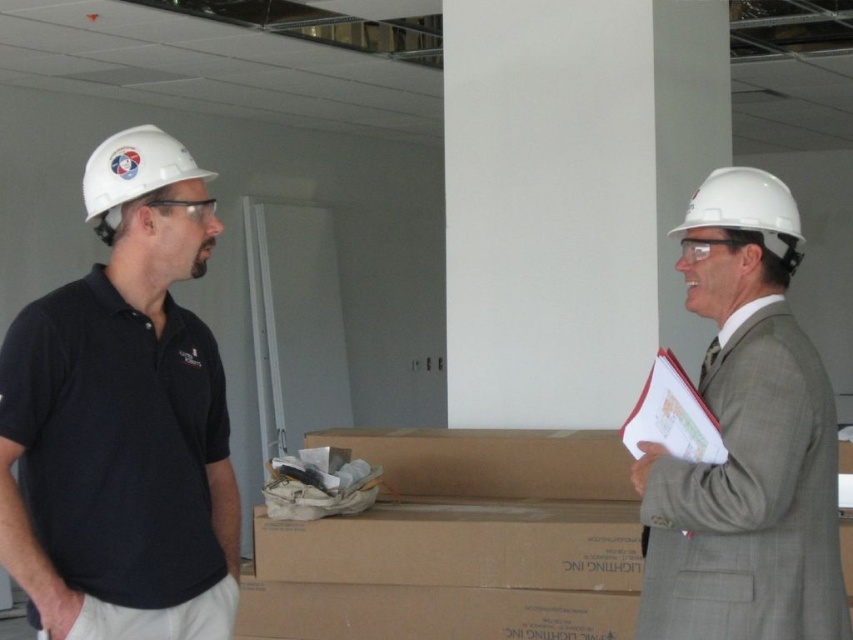
You are an architect observing two workers at a construction site. You notice a matte black polo shirt at left and a white hard hat at left. Which object is taller?

The matte black polo shirt at left is taller than the white hard hat at left according to the description.

Based on the scene described, which individual is positioned lower in the image, the person wearing the white hard hat at left or the one with the white hard hat at right?

The white hard hat at right is located below the white hard hat at left, so the person with the white hard hat at right is positioned lower in the image.